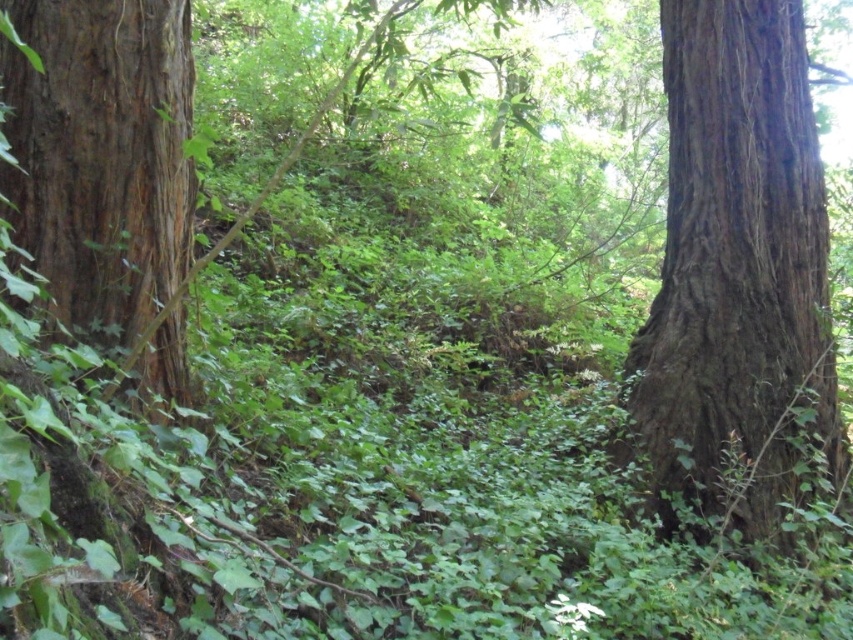
Question: Which point appears closest to the camera in this image?

Choices:
 (A) (651, 426)
 (B) (120, 163)

Answer: (B)

Question: Can you confirm if brown rough bark tree trunk at right is positioned below smooth brown bark at left?

Choices:
 (A) yes
 (B) no

Answer: (A)

Question: Is brown rough bark tree trunk at right bigger than smooth brown bark at left?

Choices:
 (A) no
 (B) yes

Answer: (B)

Question: Is the position of brown rough bark tree trunk at right more distant than that of smooth brown bark at left?

Choices:
 (A) yes
 (B) no

Answer: (A)

Question: Which point appears closest to the camera in this image?

Choices:
 (A) (144, 292)
 (B) (743, 250)

Answer: (A)